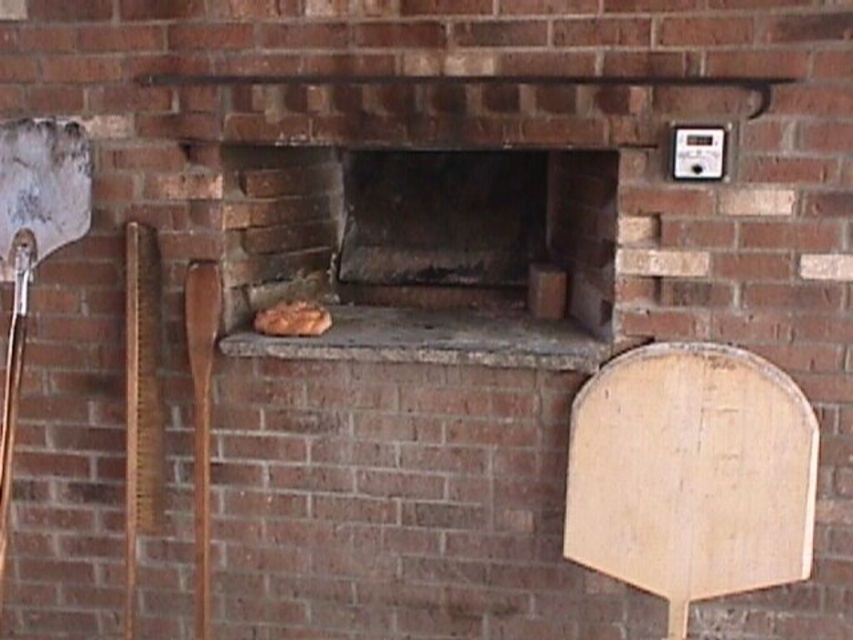
Question: Which of the following is the closest to the observer?

Choices:
 (A) (42, 154)
 (B) (299, 308)
 (C) (198, 632)

Answer: (A)

Question: Can you confirm if silver metallic shovel at left is smaller than golden brown crusty bread at center?

Choices:
 (A) no
 (B) yes

Answer: (A)

Question: Is silver metallic shovel at left behind wooden spatula at center?

Choices:
 (A) yes
 (B) no

Answer: (B)

Question: Does wooden spatula at center come in front of golden brown crusty bread at center?

Choices:
 (A) yes
 (B) no

Answer: (A)

Question: Estimate the real-world distances between objects in this image. Which object is closer to the golden brown crusty bread at center?

Choices:
 (A) silver metallic shovel at left
 (B) wooden spatula at center

Answer: (B)

Question: Which object is the closest to the golden brown crusty bread at center?

Choices:
 (A) wooden spatula at center
 (B) silver metallic shovel at left

Answer: (A)